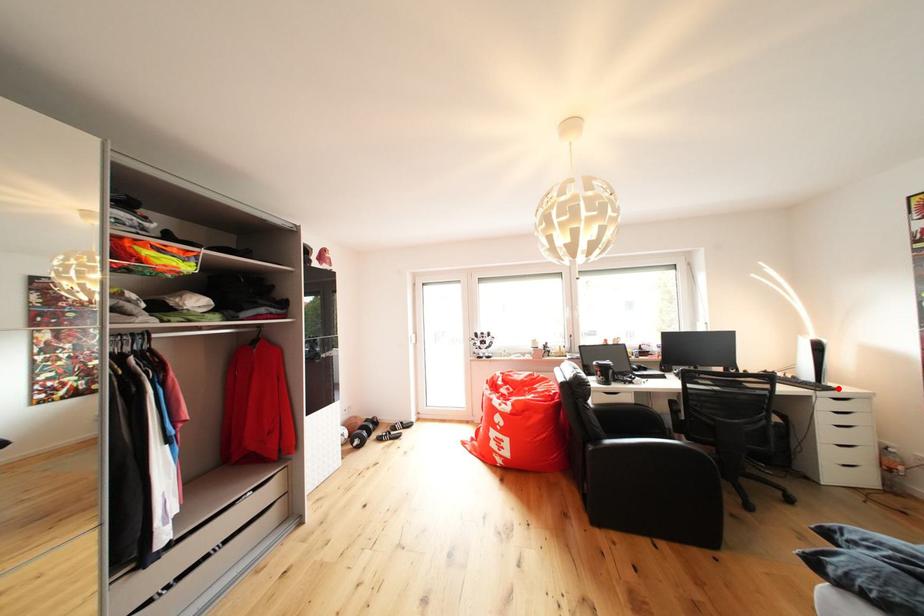
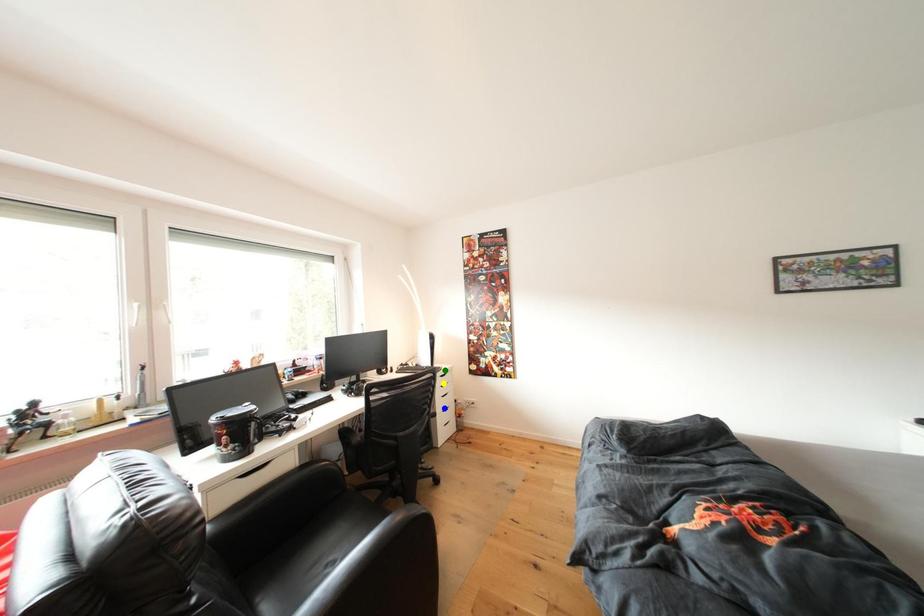
Question: I am providing you with two images of the same scene from different viewpoints. A red point is marked on the first image. You are given multiple points on the second image. Which mark in image 2 goes with the point in image 1?

Choices:
 (A) green point
 (B) blue point
 (C) yellow point

Answer: (A)